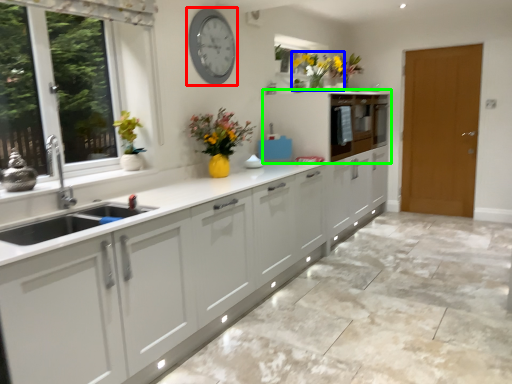
Question: Which is farther away from clock (highlighted by a red box)? floral arrangement (highlighted by a blue box) or cabinetry (highlighted by a green box)?

Choices:
 (A) floral arrangement
 (B) cabinetry

Answer: (B)